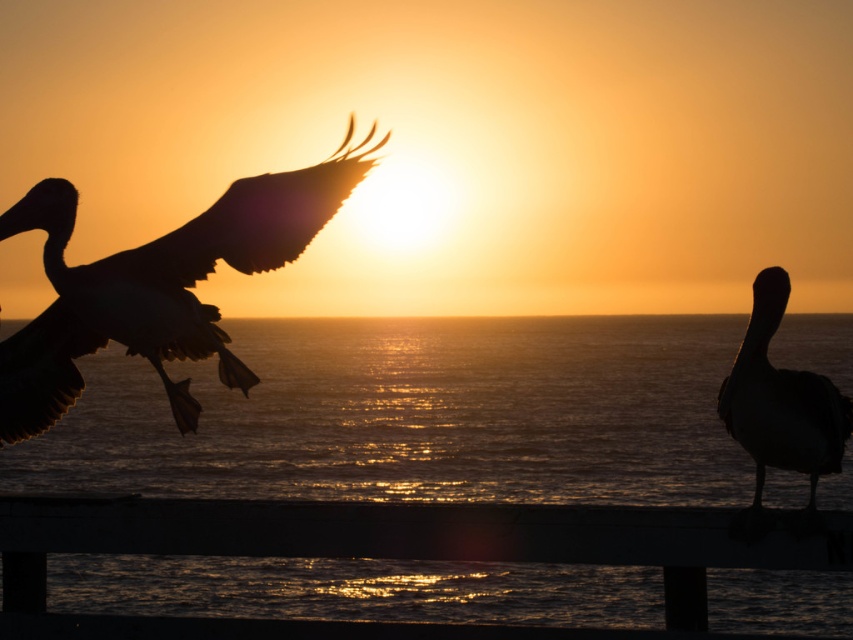
Question: Can you confirm if silhouette feathered bird at left is smaller than silhouette matte bird at right?

Choices:
 (A) no
 (B) yes

Answer: (A)

Question: Does smooth wood rail at lower center have a lesser width compared to silhouette matte bird at right?

Choices:
 (A) yes
 (B) no

Answer: (B)

Question: Which object is positioned farthest from the shiny metallic water at center?

Choices:
 (A) silhouette matte bird at right
 (B) smooth wood rail at lower center
 (C) silhouette feathered bird at left

Answer: (B)

Question: Which object is the closest to the silhouette matte bird at right?

Choices:
 (A) shiny metallic water at center
 (B) smooth wood rail at lower center
 (C) silhouette feathered bird at left

Answer: (B)

Question: Is shiny metallic water at center to the left of smooth wood rail at lower center from the viewer's perspective?

Choices:
 (A) yes
 (B) no

Answer: (A)

Question: Which point is closer to the camera?

Choices:
 (A) (695, 550)
 (B) (41, 227)
 (C) (822, 419)

Answer: (A)